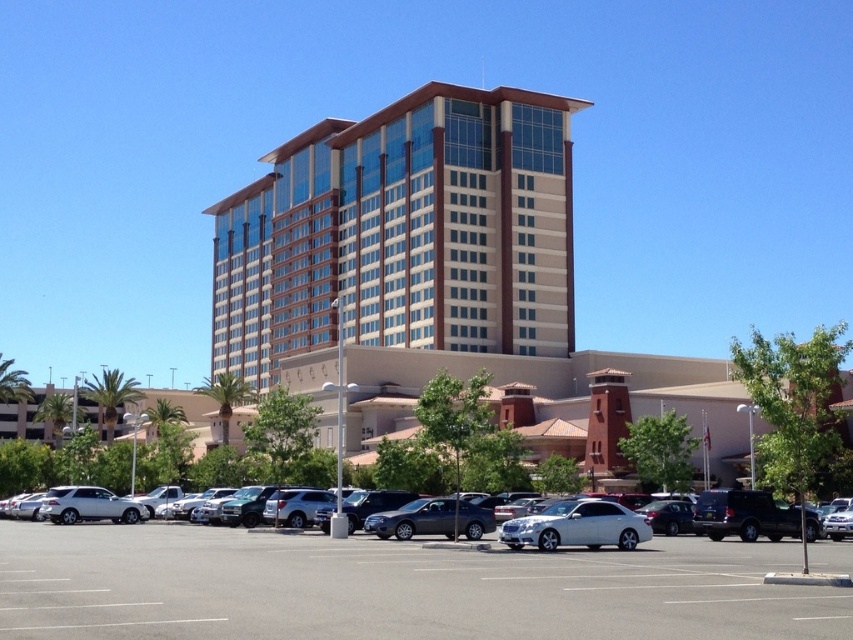
Question: Which is nearer to the white glossy sedan at center?

Choices:
 (A) silver metallic sedan at center
 (B) gray asphalt parking lot at lower center

Answer: (B)

Question: Which of the following is the farthest from the observer?

Choices:
 (A) silver metallic sedan at center
 (B) beige glass building at center
 (C) gray asphalt parking lot at lower center
 (D) white glossy sedan at center

Answer: (B)

Question: Which is nearer to the gray asphalt parking lot at lower center?

Choices:
 (A) white glossy sedan at center
 (B) silver metallic sedan at center
 (C) beige glass building at center

Answer: (A)

Question: Is white glossy sedan at center above silver metallic sedan at center?

Choices:
 (A) no
 (B) yes

Answer: (B)

Question: Observing the image, what is the correct spatial positioning of beige glass building at center in reference to gray asphalt parking lot at lower center?

Choices:
 (A) above
 (B) below

Answer: (A)

Question: Does white glossy sedan at center appear over silver metallic sedan at center?

Choices:
 (A) no
 (B) yes

Answer: (B)